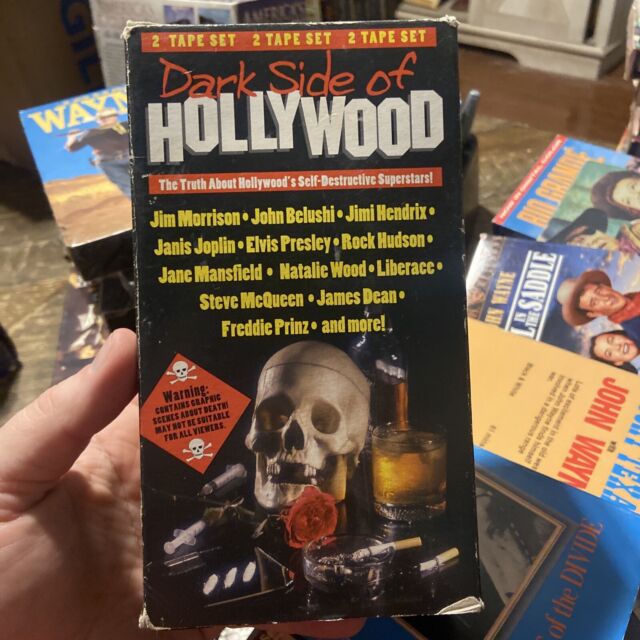
Where is `glass`? The image size is (640, 640). glass is located at coordinates (416, 467).